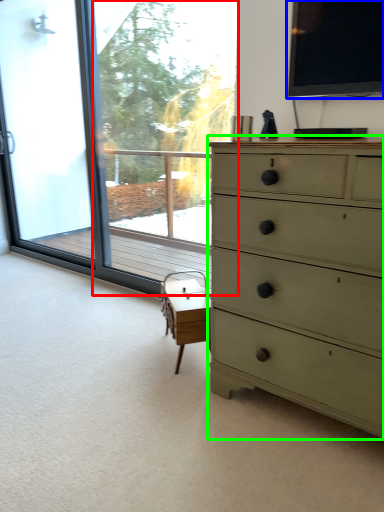
Question: Which object is positioned closest to window screen (highlighted by a red box)? Select from window screen (highlighted by a blue box) and chest of drawers (highlighted by a green box).

Choices:
 (A) window screen
 (B) chest of drawers

Answer: (A)